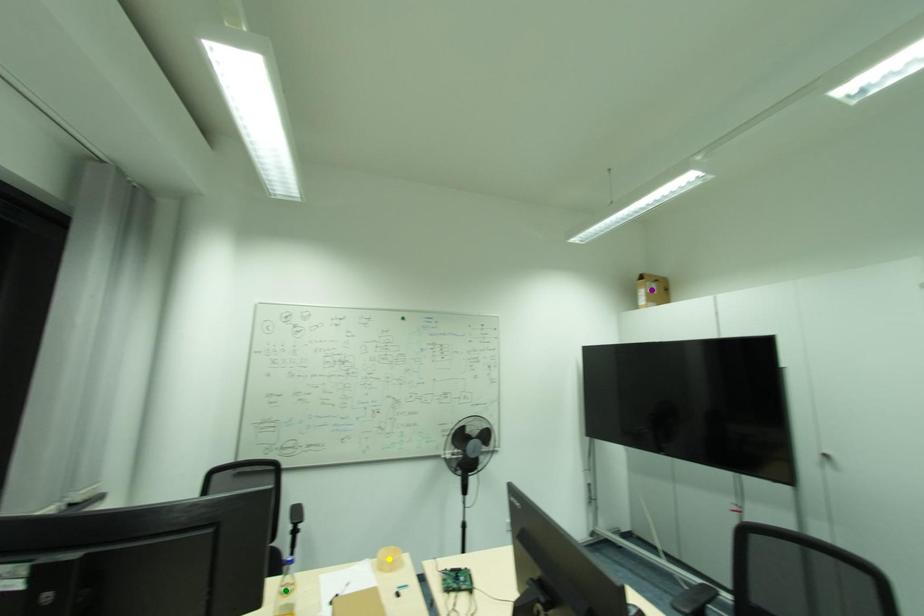
Order these from farthest to nearest:
yellow point | purple point | green point

purple point
yellow point
green point